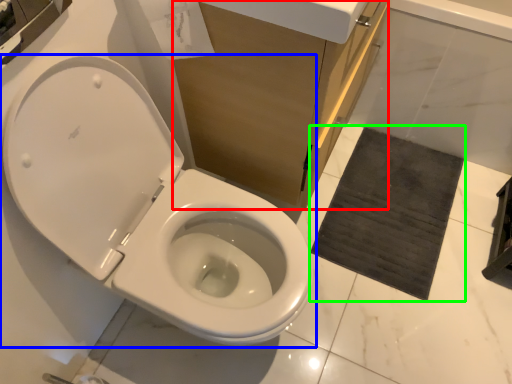
Question: Considering the real-world distances, which object is closest to cabinetry (highlighted by a red box)? toilet (highlighted by a blue box) or bath mat (highlighted by a green box).

Choices:
 (A) toilet
 (B) bath mat

Answer: (A)